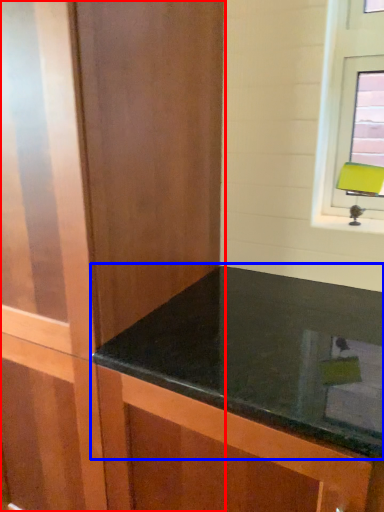
Question: Which object appears farthest to the camera in this image, dresser (highlighted by a red box) or countertop (highlighted by a blue box)?

Choices:
 (A) dresser
 (B) countertop

Answer: (A)